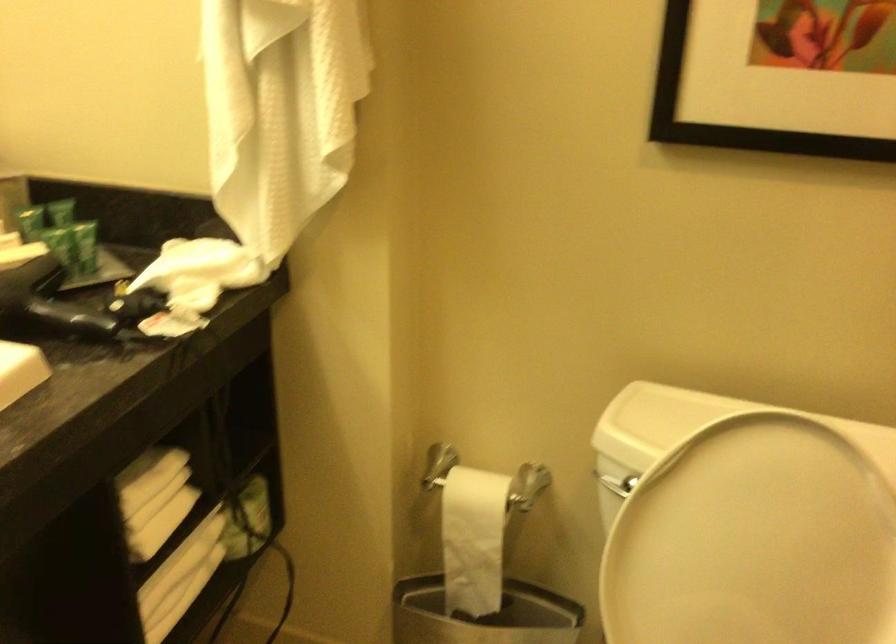
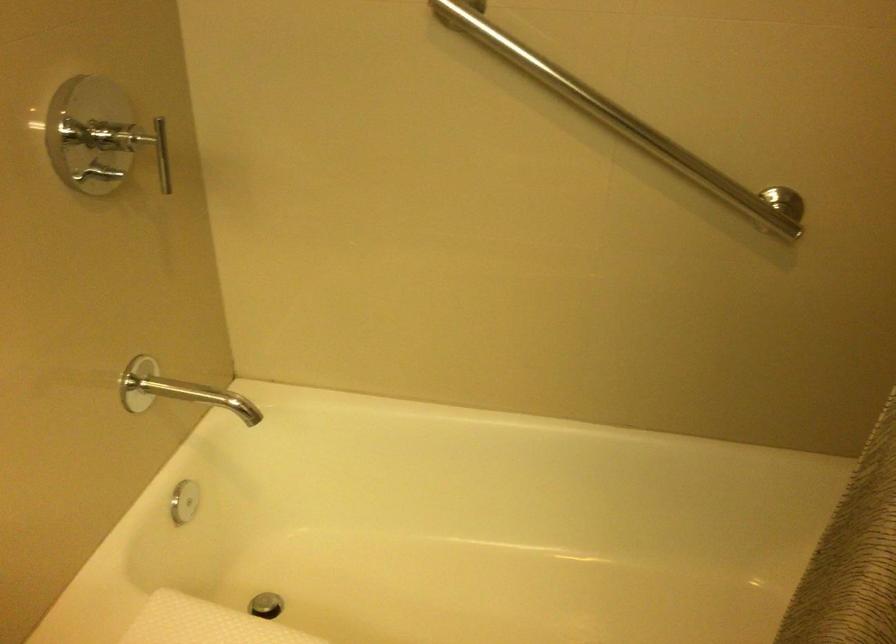
The images are taken continuously from a first-person perspective. In which direction is your viewpoint rotating?

The camera rotated toward right-down.